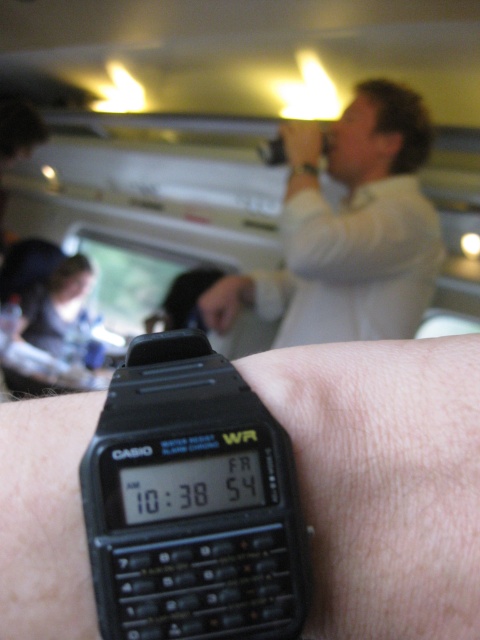
Between point (312, 154) and point (206, 300), which one is positioned behind?

Positioned behind is point (206, 300).

Measure the distance between point (356, 97) and camera.

They are 6.62 feet apart.

Where is `white matte shirt at upper center`? The width and height of the screenshot is (480, 640). white matte shirt at upper center is located at coordinates (356, 225).

From the picture: Is black plastic calculator at center below white matte shirt at upper center?

Indeed, black plastic calculator at center is positioned under white matte shirt at upper center.

Image resolution: width=480 pixels, height=640 pixels. In order to click on black plastic calculator at center in this screenshot , I will do `click(192, 500)`.

At what (x,y) coordinates should I click in order to perform the action: click on black plastic calculator at center. Please return your answer as a coordinate pair (x, y). This screenshot has width=480, height=640. Looking at the image, I should click on (192, 500).

Is black plastic watch at center below matte black watch at center?

Indeed, black plastic watch at center is positioned under matte black watch at center.

Can you confirm if black plastic watch at center is smaller than matte black watch at center?

Yes, black plastic watch at center is smaller than matte black watch at center.

Which is in front, point (459, 451) or point (250, 289)?

Positioned in front is point (459, 451).

Where is `black plastic watch at center`? This screenshot has width=480, height=640. black plastic watch at center is located at coordinates (384, 480).